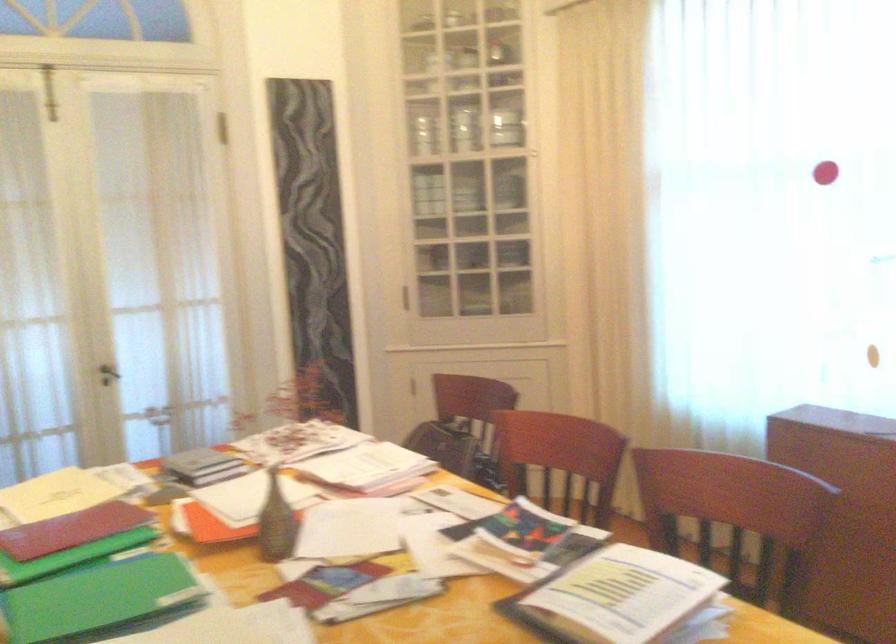
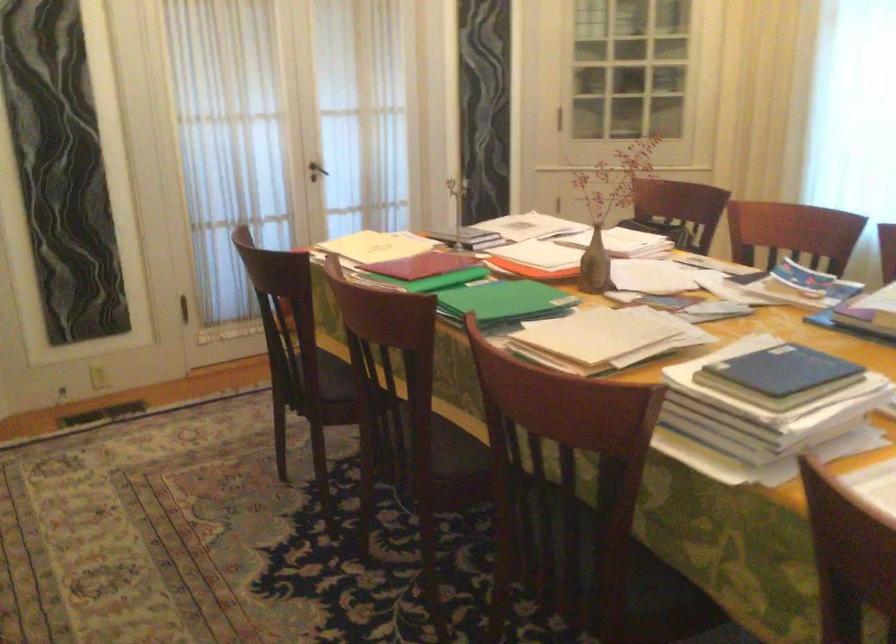
Where in the second image is the point corresponding to [80,524] from the first image?

(423, 265)